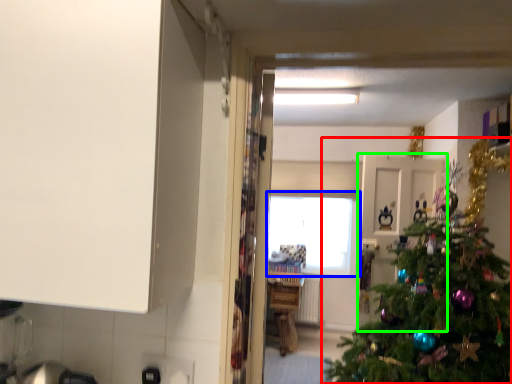
Question: Considering the real-world distances, which object is closest to christmas tree (highlighted by a red box)? window (highlighted by a blue box) or door (highlighted by a green box).

Choices:
 (A) window
 (B) door

Answer: (B)